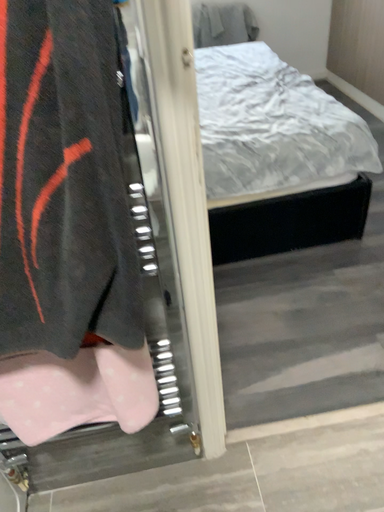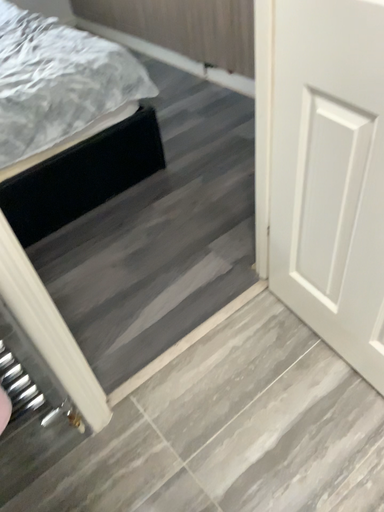
Question: How did the camera likely rotate when shooting the video?

Choices:
 (A) rotated left
 (B) rotated right

Answer: (B)